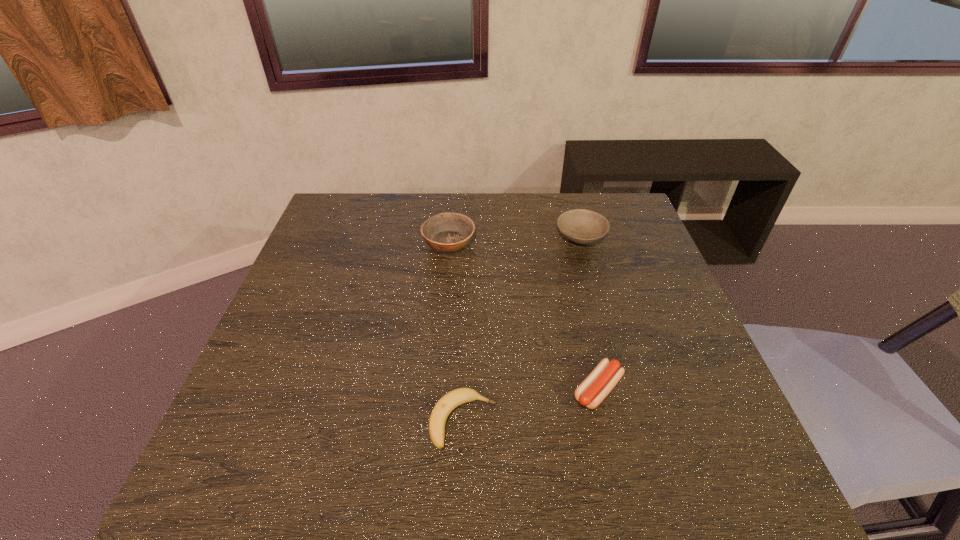
This screenshot has height=540, width=960. Identify the location of the left bowl. (448, 232).

Where is `the shorter bowl`? the shorter bowl is located at coordinates (582, 226).

I want to click on sausage, so click(594, 389).

Where is `banana`? banana is located at coordinates (453, 399).

In order to click on vacant region located 0.110m on the right of the left bowl in this screenshot , I will do `click(513, 242)`.

Identify the location of vacant area situated 0.100m on the left of the right bowl. (522, 236).

Where is `vacant area situated 0.130m on the back of the second shortest object`? vacant area situated 0.130m on the back of the second shortest object is located at coordinates (583, 323).

Locate an element on the screen. The width and height of the screenshot is (960, 540). free space located on the left of the banana is located at coordinates (243, 421).

Where is `object that is at the right edge`? This screenshot has width=960, height=540. object that is at the right edge is located at coordinates (582, 226).

You are a GUI agent. You are given a task and a screenshot of the screen. Output one action in this format:
    pyautogui.click(x=<x>, y=<y>)
    Task: Click on the object at the far right corner
    The height and width of the screenshot is (540, 960).
    Given the screenshot: What is the action you would take?
    pyautogui.click(x=582, y=226)